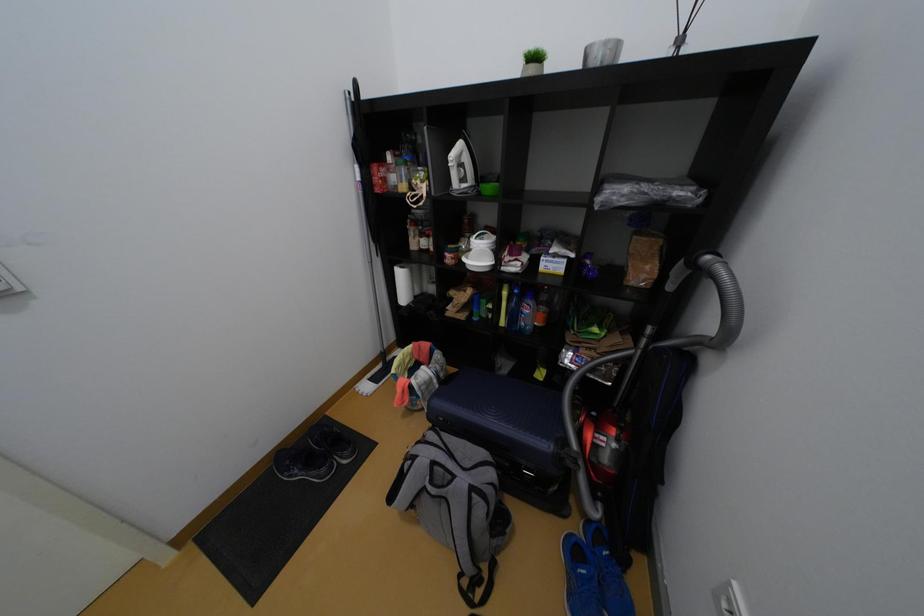
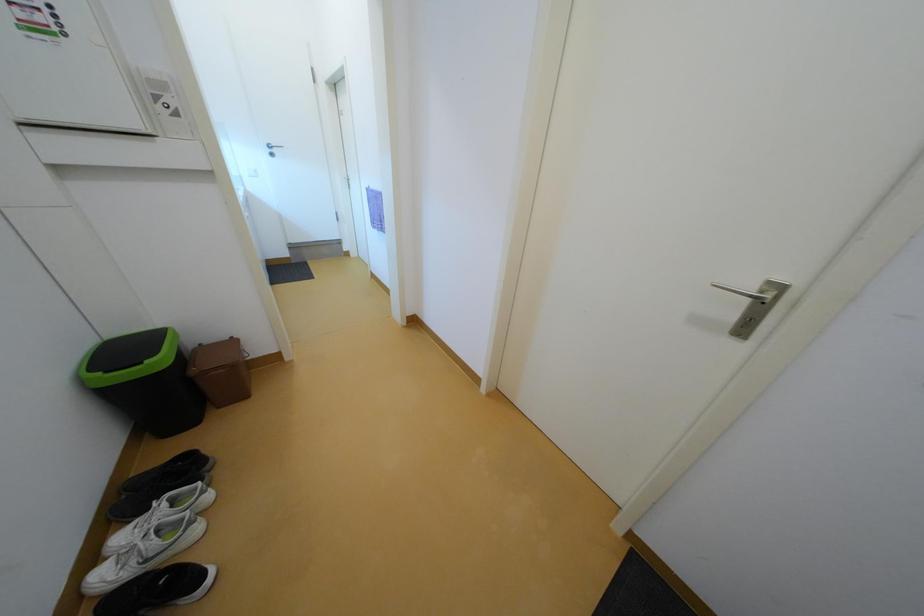
The images are taken continuously from a first-person perspective. In which direction is your viewpoint rotating?

The rotation direction of the camera is left-down.